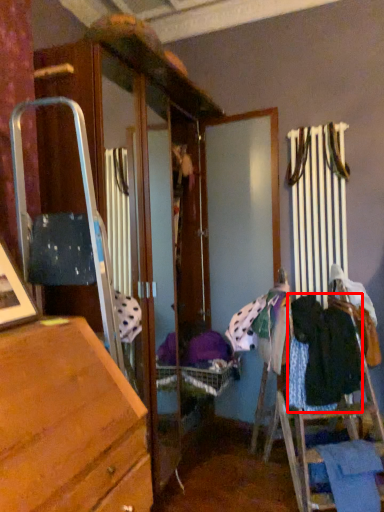
Question: From the image's perspective, where is clothing (annotated by the red box) located in relation to clothing in the image?

Choices:
 (A) below
 (B) above

Answer: (B)